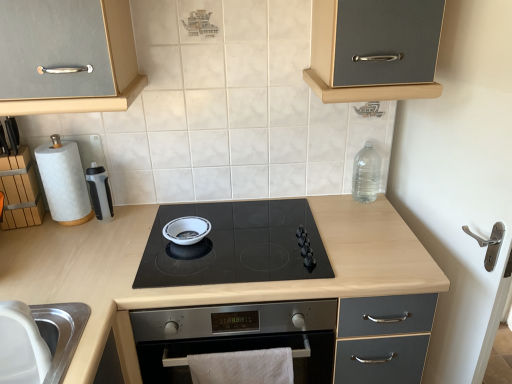
This screenshot has height=384, width=512. I want to click on empty space that is in between clear plastic bottle at upper right and wooden block at left, so click(x=226, y=211).